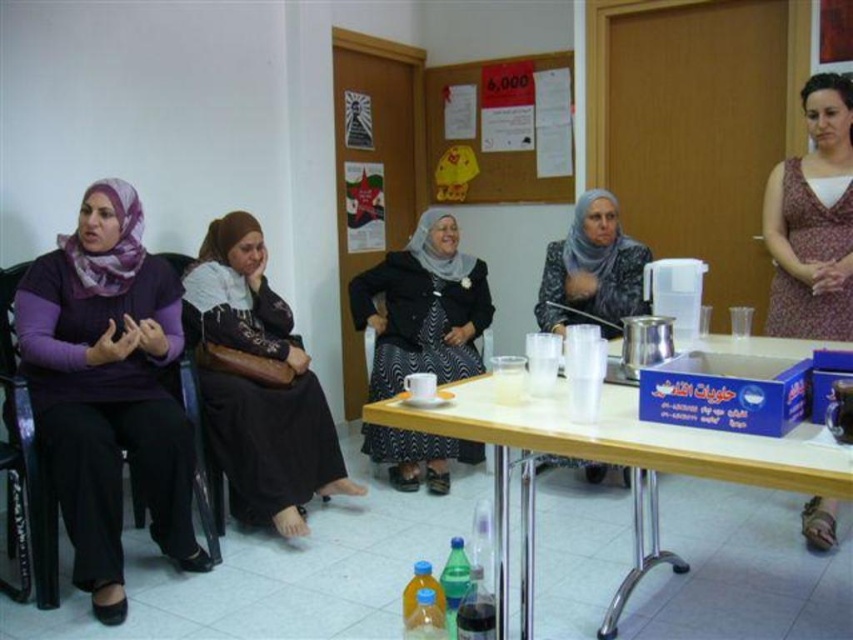
Does wooden corkboard at upper center appear under matte black hijab at center?

Actually, wooden corkboard at upper center is above matte black hijab at center.

Is point (445, 189) less distant than point (552, 285)?

That is False.

Locate an element on the screen. The height and width of the screenshot is (640, 853). wooden corkboard at upper center is located at coordinates (500, 131).

Where is `wooden corkboard at upper center`? wooden corkboard at upper center is located at coordinates (500, 131).

Is purple matte hijab at left below wooden table at center?

Incorrect, purple matte hijab at left is not positioned below wooden table at center.

Who is more distant from viewer, (33, 259) or (801, 426)?

Positioned behind is point (33, 259).

You are a GUI agent. You are given a task and a screenshot of the screen. Output one action in this format:
    pyautogui.click(x=<x>, y=<y>)
    Task: Click on the purple matte hijab at left
    
    Given the screenshot: What is the action you would take?
    pyautogui.click(x=108, y=388)

Can you confirm if black fabric dress at left is positioned to the right of matte black hijab at center?

Incorrect, black fabric dress at left is not on the right side of matte black hijab at center.

Does black fabric dress at left have a lesser width compared to matte black hijab at center?

In fact, black fabric dress at left might be wider than matte black hijab at center.

Is point (306, 372) positioned before point (540, 314)?

Yes, it is in front of point (540, 314).

Locate an element on the screen. black fabric dress at left is located at coordinates (258, 384).